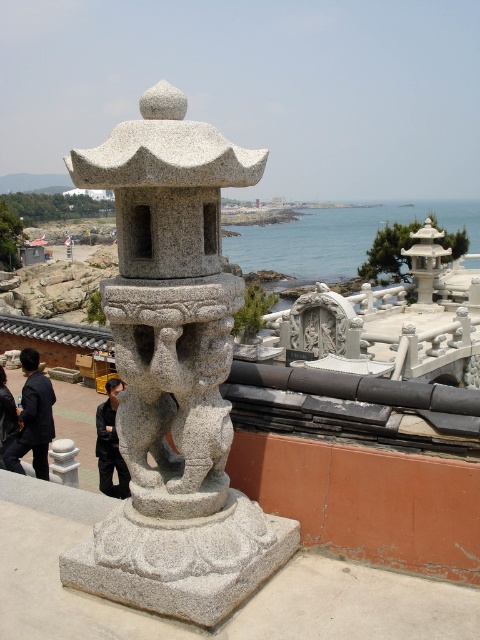
You are a fashion designer observing a coastal scene with a dark blue suit at lower left and a black fabric jacket at lower left. Which clothing item is taller?

The dark blue suit at lower left is much taller than the black fabric jacket at lower left.

You are standing in a coastal area with a traditional East Asian architectural setting. You see a blue water at center and a black matte jacket at center. Which object is located to the right of the other?

The blue water at center is positioned on the right side of black matte jacket at center.